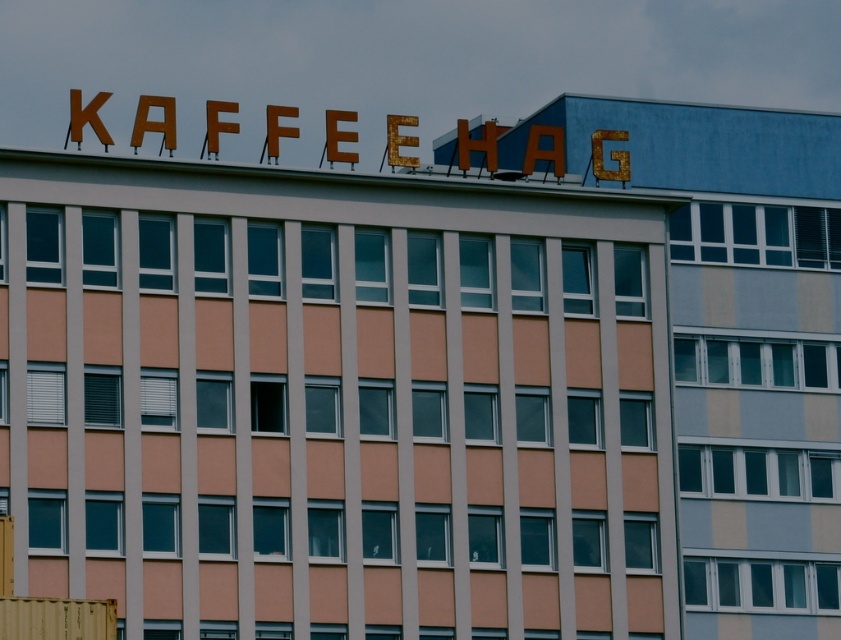
The height and width of the screenshot is (640, 841). What do you see at coordinates (739, 342) in the screenshot? I see `rusty metal sign at upper center` at bounding box center [739, 342].

Is point (802, 625) closer to camera compared to point (85, 634)?

That is False.

Which is in front, point (779, 200) or point (73, 624)?

Point (73, 624)

Identify the location of rusty metal sign at upper center. The height and width of the screenshot is (640, 841). (739, 342).